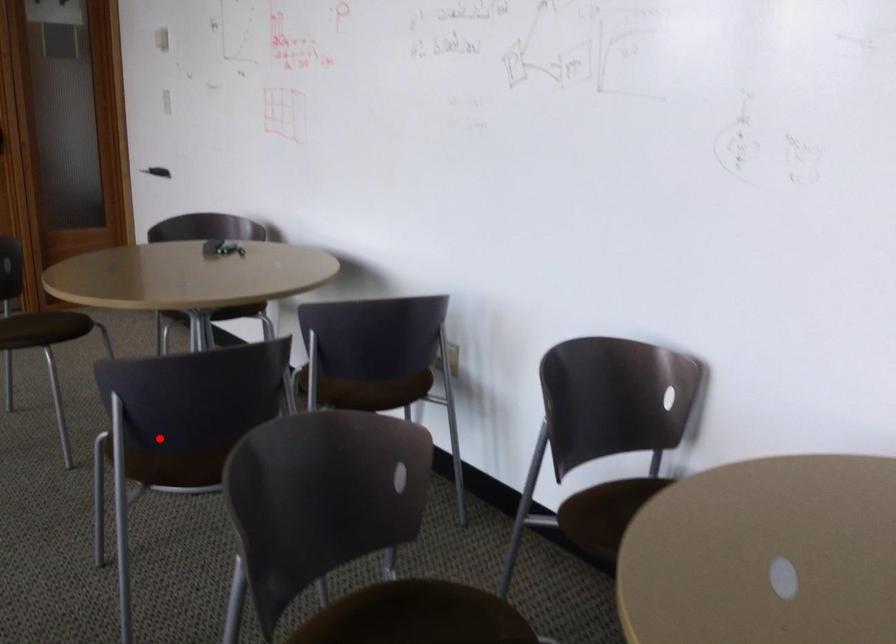
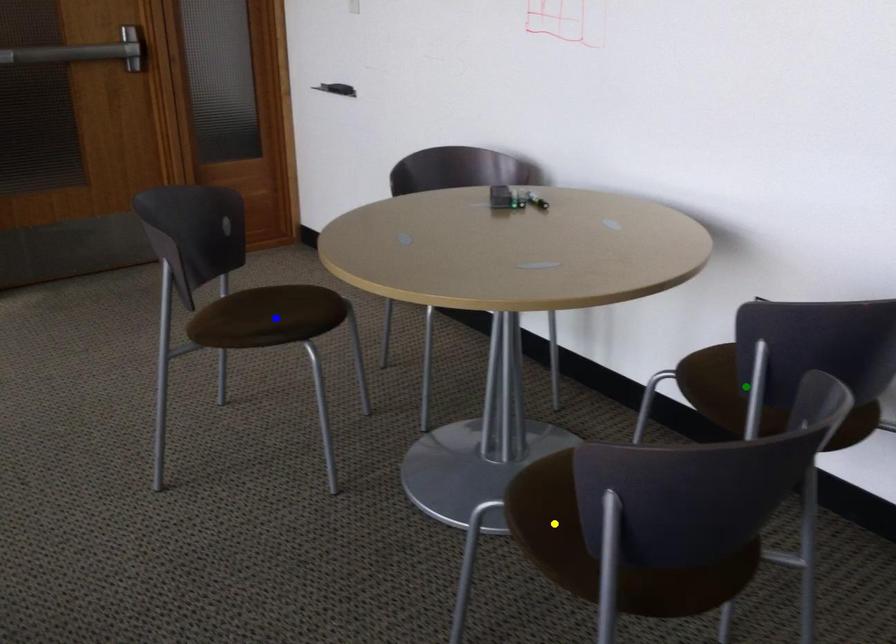
Question: I am providing you with two images of the same scene from different viewpoints. A red point is marked on the first image. You are given multiple points on the second image. Can you choose the point in image 2 that corresponds to the point in image 1?

Choices:
 (A) blue point
 (B) green point
 (C) yellow point

Answer: (C)